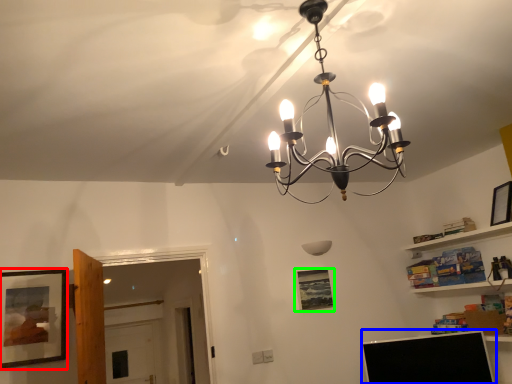
Question: Which object is positioned closest to picture frame (highlighted by a red box)? Select from computer monitor (highlighted by a blue box) and picture frame (highlighted by a green box).

Choices:
 (A) computer monitor
 (B) picture frame

Answer: (B)